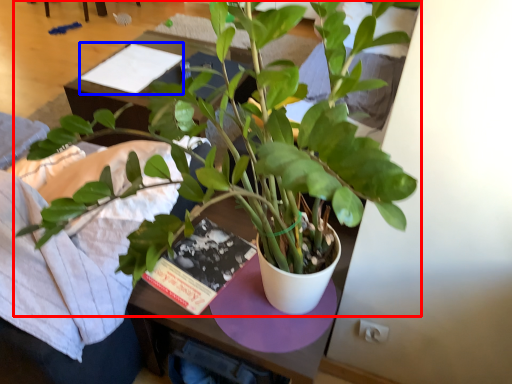
Question: Which object appears closest to the camera in this image, houseplant (highlighted by a red box) or book (highlighted by a blue box)?

Choices:
 (A) houseplant
 (B) book

Answer: (A)